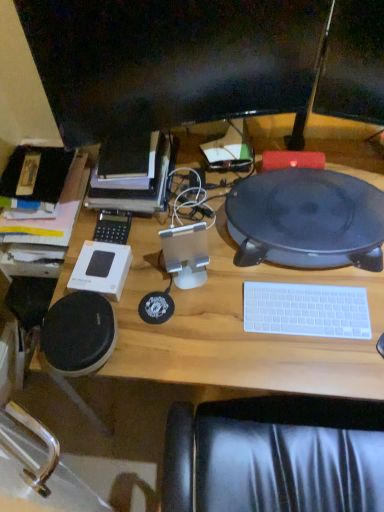
At what (x,y) coordinates should I click in order to perform the action: click on vacant space to the left of matte black tablet at center. Please return your answer as a coordinate pair (x, y). The height and width of the screenshot is (512, 384). Looking at the image, I should click on coord(203,251).